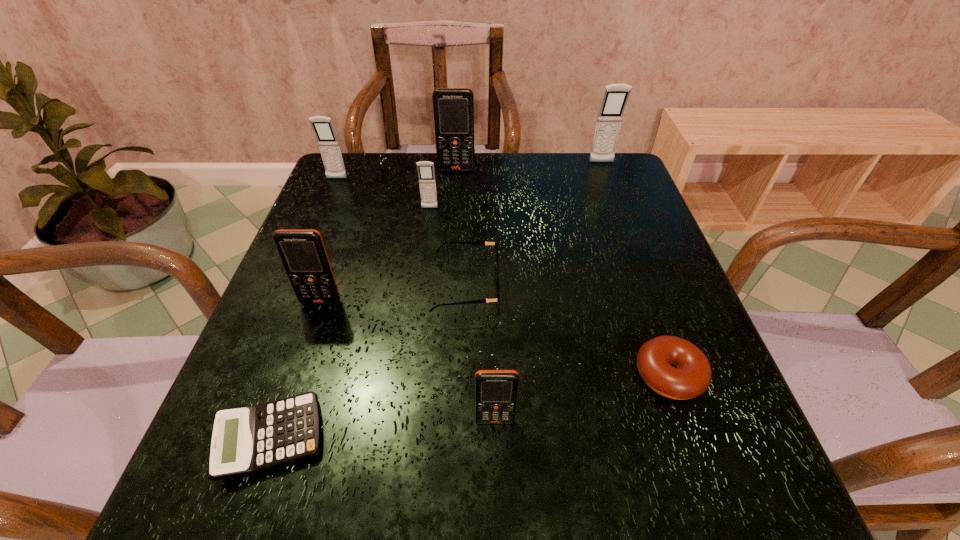
This screenshot has height=540, width=960. Identify the location of cellular telephone that is the closest to the second nearest gray cellular telephone. (426, 174).

Select which cellular telephone is the fifth closest to the nearest cellular telephone. Please provide its 2D coordinates. Your answer should be formatted as a tuple, i.e. [(x, y)], where the tuple contains the x and y coordinates of a point satisfying the conditions above.

[(615, 97)]

Find the location of a particular element. The image size is (960, 540). gray cellular telephone that is the closest to the third farthest cellular telephone is located at coordinates point(426,174).

Identify which gray cellular telephone is the third nearest to the rightmost orange cellular telephone. Please provide its 2D coordinates. Your answer should be formatted as a tuple, i.e. [(x, y)], where the tuple contains the x and y coordinates of a point satisfying the conditions above.

[(615, 97)]

What are the coordinates of `orange cellular telephone that is the closest to the biggest gray cellular telephone` in the screenshot? It's located at (453, 108).

Find the location of `orange cellular telephone that stands as the closest to the smallest orange cellular telephone`. orange cellular telephone that stands as the closest to the smallest orange cellular telephone is located at coordinates (302, 252).

Identify the location of vacant space that satisfies the following two spatial constraints: 1. on the back side of the shortest object; 2. on the right side of the chocolate doughnut. point(293,375).